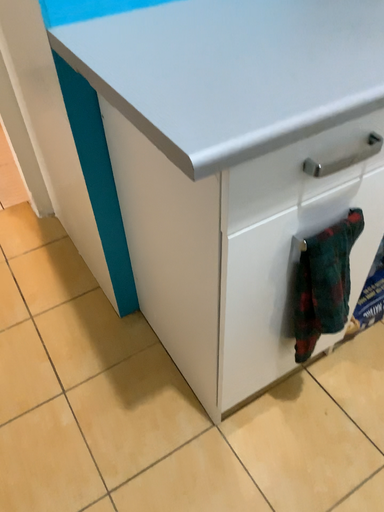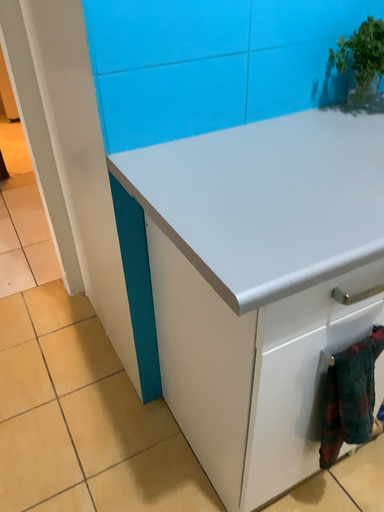
Question: Which way did the camera rotate in the video?

Choices:
 (A) rotated downward
 (B) rotated upward

Answer: (B)